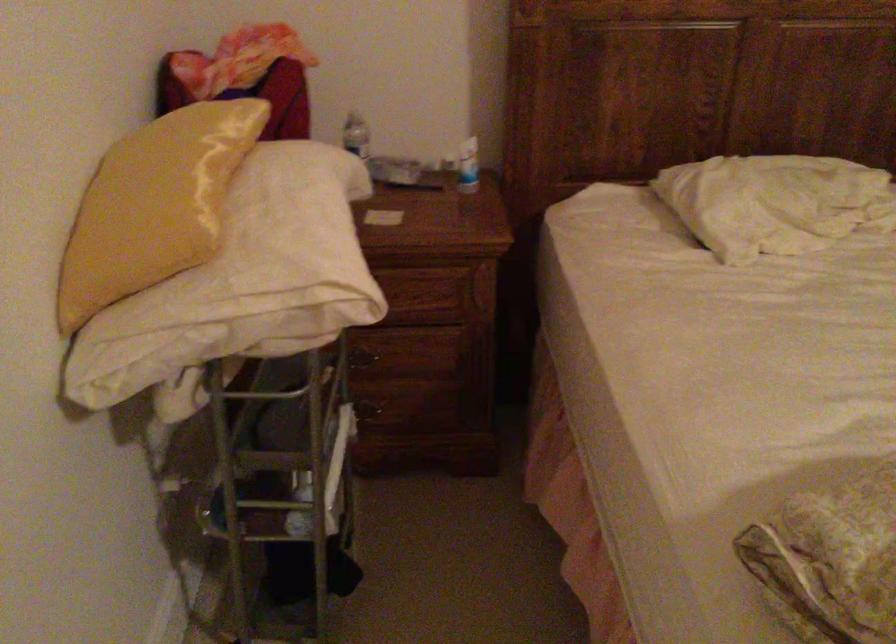
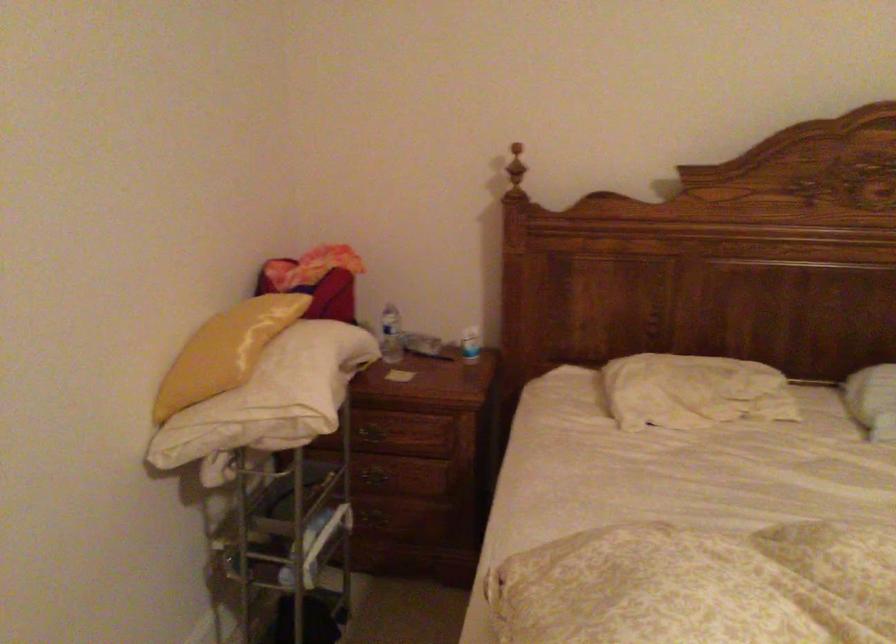
Locate, in the second image, the point that corresponds to [467,166] in the first image.

(470, 344)